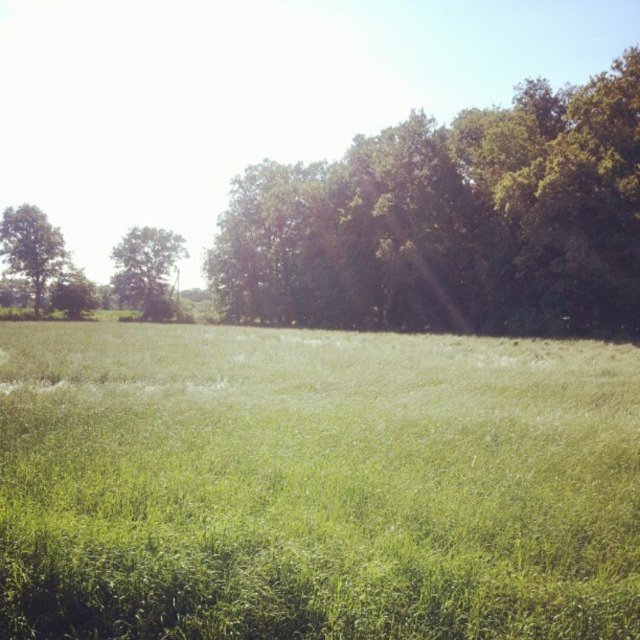
How distant is green grassy pasture at center from green leafy tree at left?

They are 72.39 meters apart.

Can you confirm if green grassy pasture at center is positioned to the left of green leafy tree at left?

Incorrect, green grassy pasture at center is not on the left side of green leafy tree at left.

Between point (390, 461) and point (44, 285), which one is positioned in front?

Point (390, 461) is in front.

Locate an element on the screen. This screenshot has width=640, height=640. green grassy pasture at center is located at coordinates (314, 484).

Which is above, green leafy tree at upper right or green leafy tree at left?

Positioned higher is green leafy tree at upper right.

Who is positioned more to the right, green leafy tree at upper right or green leafy tree at left?

Positioned to the right is green leafy tree at upper right.

Where is `green leafy tree at upper right`? This screenshot has height=640, width=640. green leafy tree at upper right is located at coordinates (451, 221).

Who is more forward, [508,545] or [134,269]?

Point [508,545] is more forward.

Measure the distance between green grassy pasture at center and camera.

green grassy pasture at center and camera are 14.88 feet apart from each other.

Who is more distant from viewer, (97, 397) or (160, 284)?

The point (160, 284) is behind.

Locate an element on the screen. This screenshot has height=640, width=640. green grassy pasture at center is located at coordinates (314, 484).